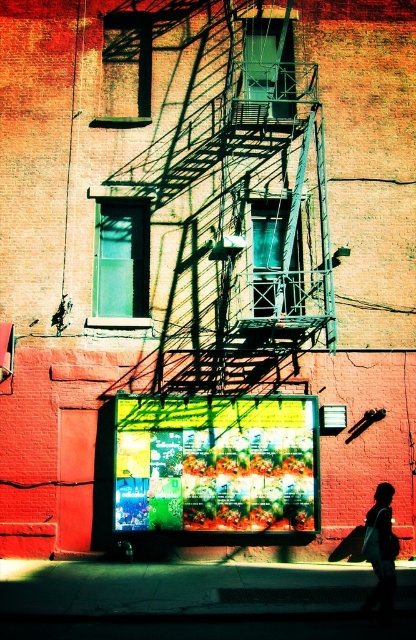
The height and width of the screenshot is (640, 416). Find the location of `green metal fire escape at center`. green metal fire escape at center is located at coordinates (240, 209).

Looking at this image, between green metal fire escape at center and silhouette bag at lower right, which one has less height?

silhouette bag at lower right

The image size is (416, 640). In order to click on green metal fire escape at center in this screenshot , I will do click(x=240, y=209).

Is point (376, 564) positioned in front of point (72, 84)?

That is True.

Does silhouette bag at lower right appear over red wire at upper left?

No.

Find the location of a particular element. The height and width of the screenshot is (640, 416). silhouette bag at lower right is located at coordinates (381, 550).

You are a GUI agent. You are given a task and a screenshot of the screen. Output one action in this format:
    pyautogui.click(x=<x>, y=<y>)
    Task: Click on the silhouette bag at lower right
    
    Given the screenshot: What is the action you would take?
    pyautogui.click(x=381, y=550)

From the picture: Is green metal fire escape at center shorter than red wire at upper left?

Incorrect, green metal fire escape at center's height does not fall short of red wire at upper left's.

Is green metal fire escape at center further to the viewer compared to red wire at upper left?

That is False.

At what (x,y) coordinates should I click in order to perform the action: click on green metal fire escape at center. Please return your answer as a coordinate pair (x, y). Looking at the image, I should click on (240, 209).

What are the coordinates of `green metal fire escape at center` in the screenshot? It's located at (240, 209).